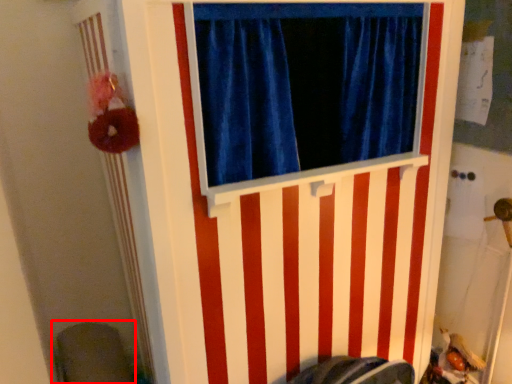
Question: From the image's perspective, what is the correct spatial relationship of swivel chair (annotated by the red box) in relation to barn door?

Choices:
 (A) below
 (B) above

Answer: (A)